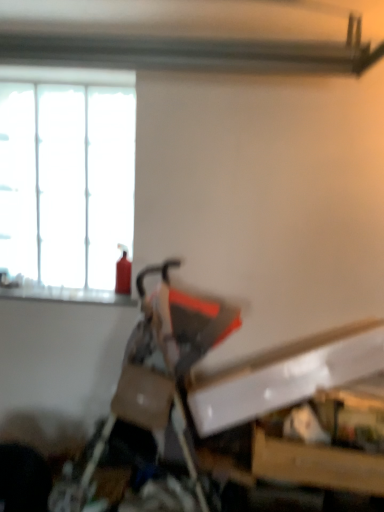
Question: From a real-world perspective, is matte black swivel chair at center located higher than white frosted glass window at upper left?

Choices:
 (A) no
 (B) yes

Answer: (A)

Question: Is matte black swivel chair at center not close to white frosted glass window at upper left?

Choices:
 (A) yes
 (B) no

Answer: (B)

Question: Is matte black swivel chair at center closer to the viewer compared to white frosted glass window at upper left?

Choices:
 (A) yes
 (B) no

Answer: (A)

Question: Does matte black swivel chair at center appear on the left side of white frosted glass window at upper left?

Choices:
 (A) no
 (B) yes

Answer: (A)

Question: Is matte black swivel chair at center oriented towards white frosted glass window at upper left?

Choices:
 (A) no
 (B) yes

Answer: (A)

Question: Looking at their shapes, would you say matte black swivel chair at center is wider or thinner than red matte fire extinguisher at left?

Choices:
 (A) thin
 (B) wide

Answer: (B)

Question: Which is correct: matte black swivel chair at center is inside red matte fire extinguisher at left, or outside of it?

Choices:
 (A) inside
 (B) outside

Answer: (B)

Question: Is matte black swivel chair at center bigger or smaller than red matte fire extinguisher at left?

Choices:
 (A) small
 (B) big

Answer: (B)

Question: Is matte black swivel chair at center in front of or behind red matte fire extinguisher at left in the image?

Choices:
 (A) behind
 (B) front

Answer: (B)

Question: From a real-world perspective, relative to matte black swivel chair at center, is white frosted glass window at upper left vertically above or below?

Choices:
 (A) above
 (B) below

Answer: (A)

Question: Would you say white frosted glass window at upper left is to the left or to the right of matte black swivel chair at center in the picture?

Choices:
 (A) left
 (B) right

Answer: (A)

Question: From the image's perspective, is white frosted glass window at upper left above or below matte black swivel chair at center?

Choices:
 (A) above
 (B) below

Answer: (A)

Question: Considering the positions of white frosted glass window at upper left and matte black swivel chair at center in the image, is white frosted glass window at upper left bigger or smaller than matte black swivel chair at center?

Choices:
 (A) small
 (B) big

Answer: (A)

Question: Is red matte fire extinguisher at left taller or shorter than white frosted glass window at upper left?

Choices:
 (A) tall
 (B) short

Answer: (B)

Question: In terms of width, does red matte fire extinguisher at left look wider or thinner when compared to white frosted glass window at upper left?

Choices:
 (A) wide
 (B) thin

Answer: (A)